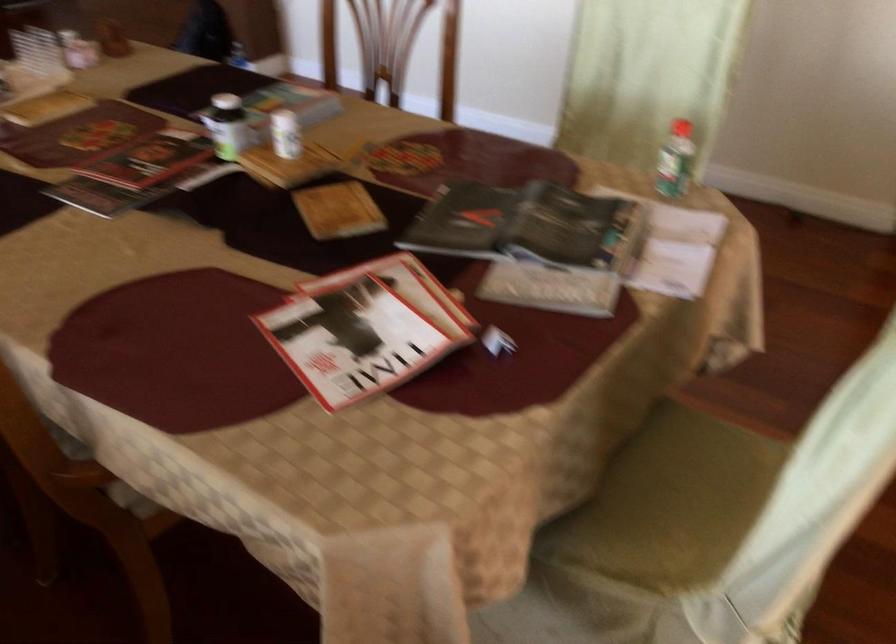
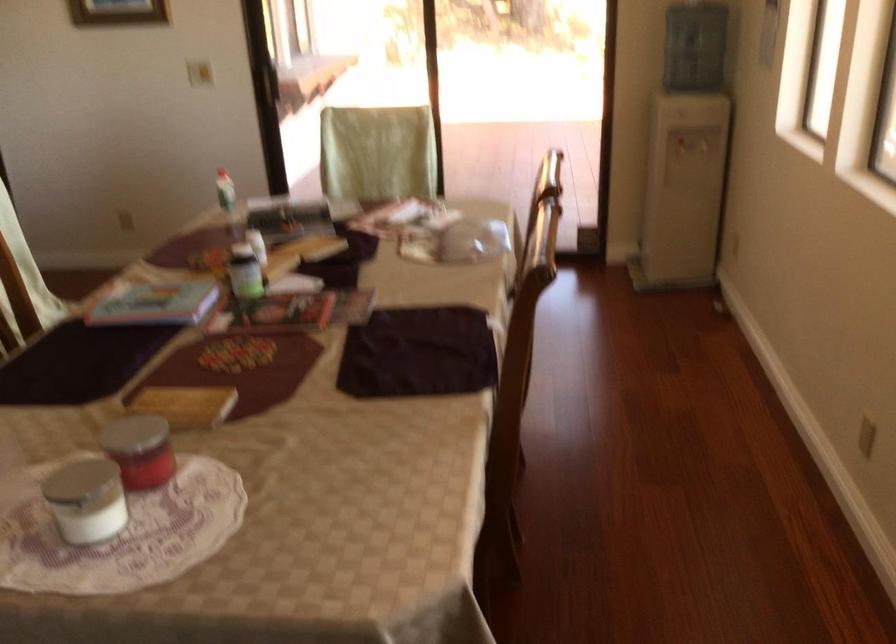
The point at (409, 275) is marked in the first image. Where is the corresponding point in the second image?

(366, 218)